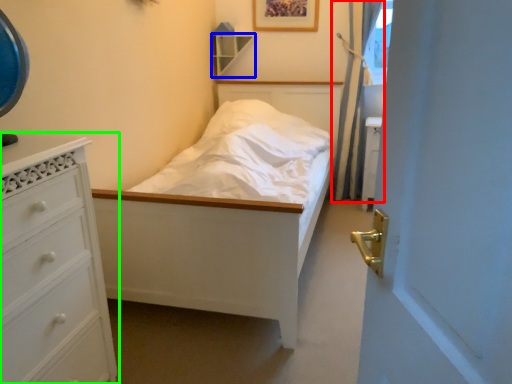
Question: Which object is the farthest from curtain (highlighted by a red box)? Choose among these: shelf (highlighted by a blue box) or chest of drawers (highlighted by a green box).

Choices:
 (A) shelf
 (B) chest of drawers

Answer: (B)